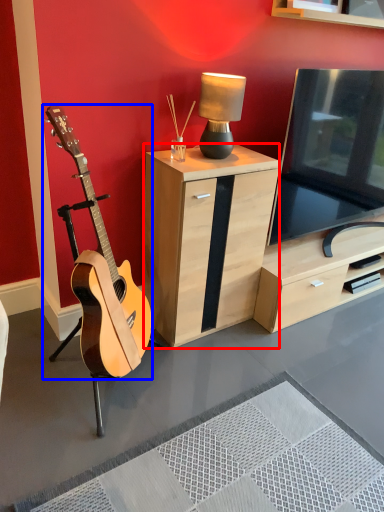
Question: Which point is closer to the camera, cabinetry (highlighted by a red box) or guitar (highlighted by a blue box)?

Choices:
 (A) cabinetry
 (B) guitar

Answer: (B)